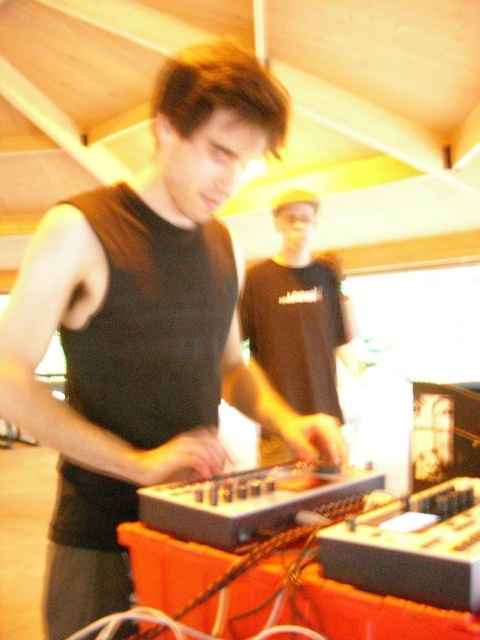
Where is the black matte tank top at center located in the image?

The black matte tank top at center is located at point (145,328) in the image.

You are at a club and see a point at coordinates (297, 312). Which object is this point located on?

The point at coordinates (297, 312) is located on the black matte shirt at center.

You are a photographer standing at the entrance of the club. You want to take a photo of the black matte tank top at center and the person in the background wearing a dark T shirt and light cap. How far apart are these two people?

The two people are 32.74 inches apart.